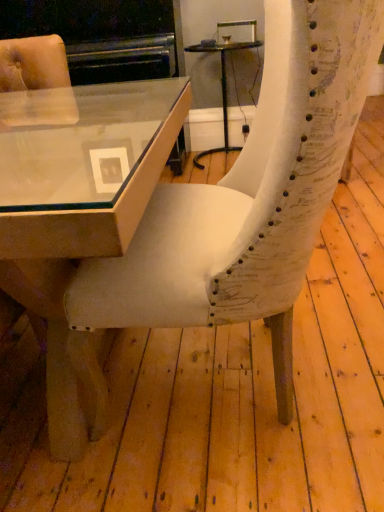
Question: From the image's perspective, is white textured chair at center located above or below matte glass table at center, arranged as the 1th table when viewed from the back?

Choices:
 (A) above
 (B) below

Answer: (B)

Question: Considering the positions of point (220, 285) and point (221, 103), is point (220, 285) closer or farther from the camera than point (221, 103)?

Choices:
 (A) closer
 (B) farther

Answer: (A)

Question: Which is nearer to the matte glass table at center, the 1th table ordered from the bottom?

Choices:
 (A) white textured chair at center
 (B) matte glass table at center, the second table in the front-to-back sequence

Answer: (A)

Question: Which object is positioned closest to the matte glass table at center, the first table when ordered from right to left?

Choices:
 (A) matte glass table at center, the 1th table ordered from the bottom
 (B) white textured chair at center

Answer: (A)